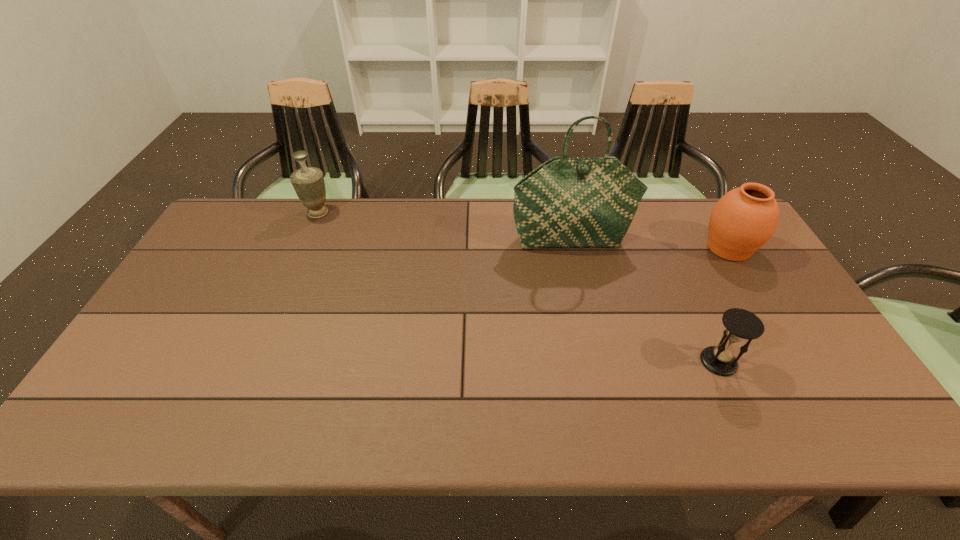
Find the location of a particular element. This screenshot has height=540, width=960. vacant space that satisfies the following two spatial constraints: 1. on the front side of the hourglass; 2. on the left side of the second object from left to right is located at coordinates (598, 362).